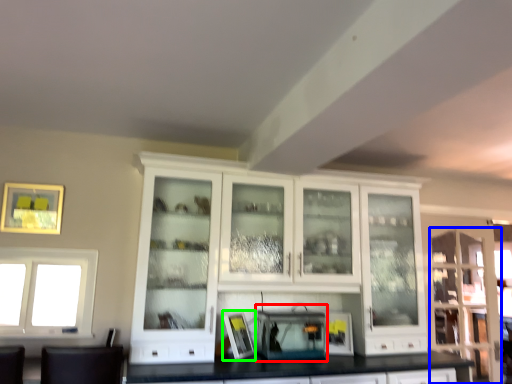
Question: Which object is positioned farthest from appliance (highlighted by a red box)? Select from glass door (highlighted by a blue box) and picture frame (highlighted by a green box).

Choices:
 (A) glass door
 (B) picture frame

Answer: (A)